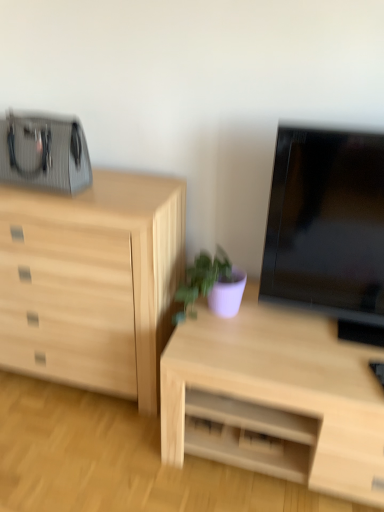
This screenshot has height=512, width=384. I want to click on free point above light wood desk at center (from a real-world perspective), so pyautogui.click(x=291, y=343).